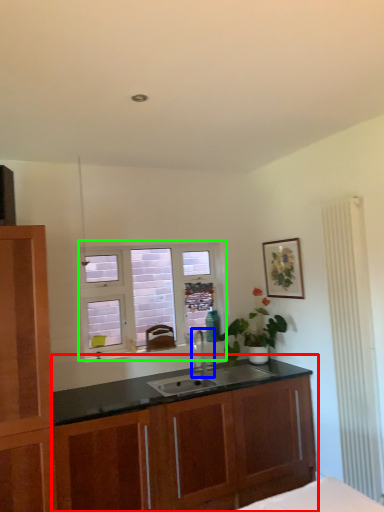
Question: Which object is the closest to the cabinetry (highlighted by a red box)? Choose among these: tap (highlighted by a blue box) or window (highlighted by a green box).

Choices:
 (A) tap
 (B) window

Answer: (A)